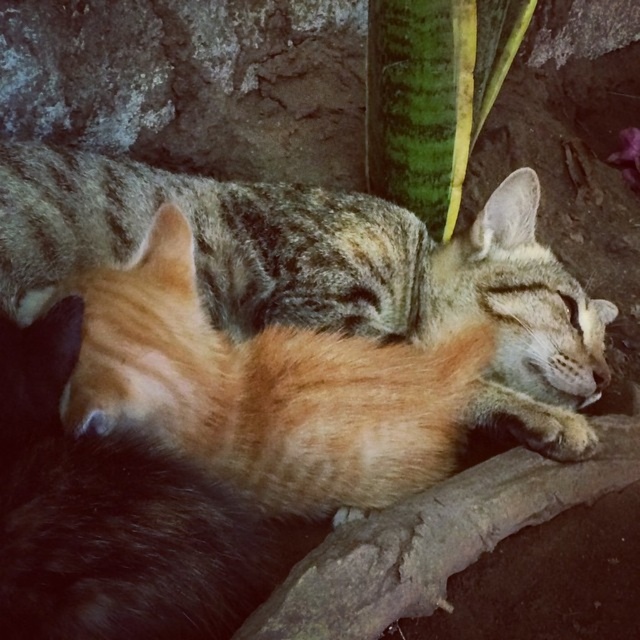
Question: Which of the following is the closest to the observer?

Choices:
 (A) [449, 202]
 (B) [566, 385]

Answer: (B)

Question: Which object appears farthest from the camera in this image?

Choices:
 (A) orange fur cat at center
 (B) green textured leaf at upper center

Answer: (B)

Question: Does orange fur cat at center appear under green textured leaf at upper center?

Choices:
 (A) yes
 (B) no

Answer: (A)

Question: Which point is farther from the camera taking this photo?

Choices:
 (A) (259, 227)
 (B) (435, 179)

Answer: (B)

Question: Is orange fur cat at center positioned before green textured leaf at upper center?

Choices:
 (A) yes
 (B) no

Answer: (A)

Question: Is orange fur cat at center further to the viewer compared to green textured leaf at upper center?

Choices:
 (A) no
 (B) yes

Answer: (A)